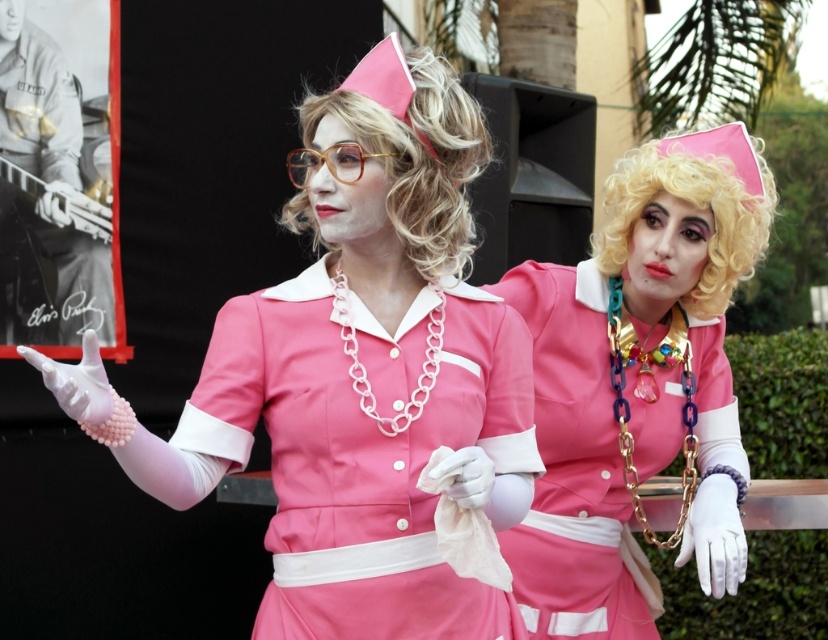
Question: Can you confirm if metallic silver guitar at upper left is positioned above blonde curly wig at upper center?

Choices:
 (A) no
 (B) yes

Answer: (B)

Question: Is metallic silver guitar at upper left to the left of translucent amber plastic glasses at center from the viewer's perspective?

Choices:
 (A) no
 (B) yes

Answer: (B)

Question: Is metallic silver guitar at upper left in front of blonde curly wig at upper center?

Choices:
 (A) yes
 (B) no

Answer: (B)

Question: Which point is farther to the camera?

Choices:
 (A) (437, 141)
 (B) (270, 595)

Answer: (B)

Question: Which point is farther to the camera?

Choices:
 (A) matte pink uniform at center
 (B) matte pink fabric dress at center

Answer: (A)

Question: Which point is farther to the camera?

Choices:
 (A) matte pink fabric dress at center
 (B) blonde hair at center
 (C) blonde curly wig at upper center

Answer: (C)